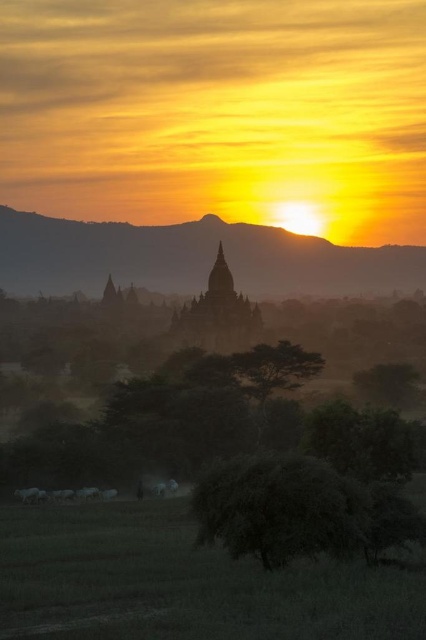
You are standing at the edge of the green grassy field at lower center and want to see the sunset clearly. Is the green leafy tree at center blocking your view? Please explain why or why not.

The green leafy tree at center is taller than the green grassy field at lower center. Since you are standing on the grassy field, the tree might block your view of the sunset depending on its exact position and the angle of the sun. However, the scene description mentions the sun is low on the horizon, so if the tree is between you and the horizon, it could obstruct the view. If you move to a spot where the tree isn

You are a photographer standing in the green grassy field at lower center. You want to take a picture of the dark gray stone temple at center. Which direction should you face to capture the temple in your shot?

The dark gray stone temple at center is above the green grassy field at lower center, so you should look upward to capture it in your shot.